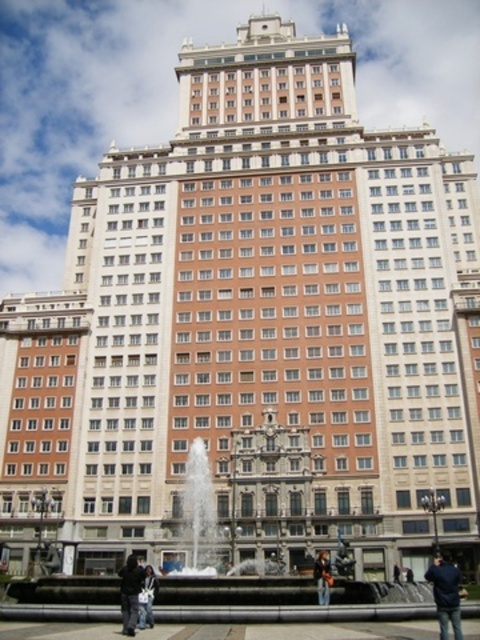
You are standing in front of the grand building and notice two points marked on the facade. The first point is at coordinate point (148, 600) and the second is at point (395, 572). Which point is closer to you?

The point at coordinate point (148, 600) is closer to the viewer than point (395, 572).

Consider the image. You are standing in front of the grand building and want to know if the dark gray jacket at lower center can fit through a doorway that is just wide enough for the denim jacket at lower center. Can it?

The dark gray jacket at lower center might be wider than the denim jacket at lower center, so it may not fit through the doorway designed for the denim jacket at lower center.